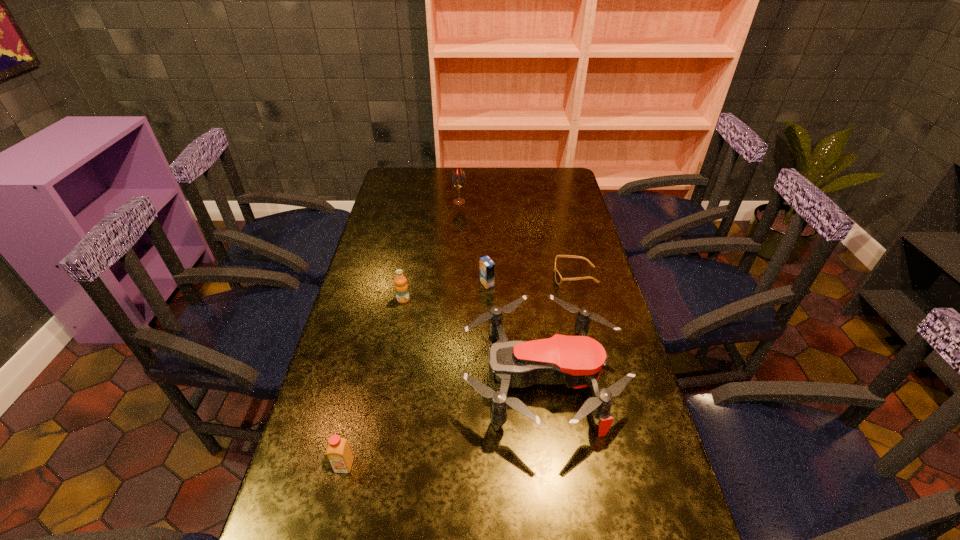
Locate an element on the screen. Image resolution: width=960 pixels, height=540 pixels. drone at the right edge is located at coordinates (578, 361).

Locate an element on the screen. The image size is (960, 540). sunglasses situated at the right edge is located at coordinates (558, 278).

Locate an element on the screen. The height and width of the screenshot is (540, 960). vacant space at the far edge of the desktop is located at coordinates (507, 186).

In order to click on vacant space at the left edge of the desktop in this screenshot , I will do `click(393, 321)`.

At what (x,y) coordinates should I click in order to perform the action: click on vacant space at the right edge of the desktop. Please return your answer as a coordinate pair (x, y). The image size is (960, 540). Looking at the image, I should click on (570, 300).

In order to click on free spot at the far left corner of the desktop in this screenshot , I will do (407, 176).

In the image, there is a desktop. At what (x,y) coordinates should I click in order to perform the action: click on vacant space at the far right corner. Please return your answer as a coordinate pair (x, y). Image resolution: width=960 pixels, height=540 pixels. Looking at the image, I should click on (561, 169).

Locate an element on the screen. This screenshot has width=960, height=540. empty location between the leftmost object and the drone is located at coordinates (443, 422).

This screenshot has height=540, width=960. What are the coordinates of `empty location between the second shortest object and the sunglasses` in the screenshot? It's located at (531, 280).

Where is `vacant area between the third object from left to right and the leftmost orange_juice`? vacant area between the third object from left to right and the leftmost orange_juice is located at coordinates (402, 334).